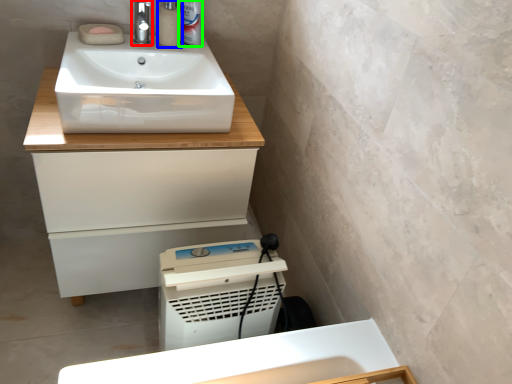
Question: Considering the real-world distances, which object is farthest from tap (highlighted by a red box)? soap dispenser (highlighted by a blue box) or toiletry (highlighted by a green box)?

Choices:
 (A) soap dispenser
 (B) toiletry

Answer: (B)